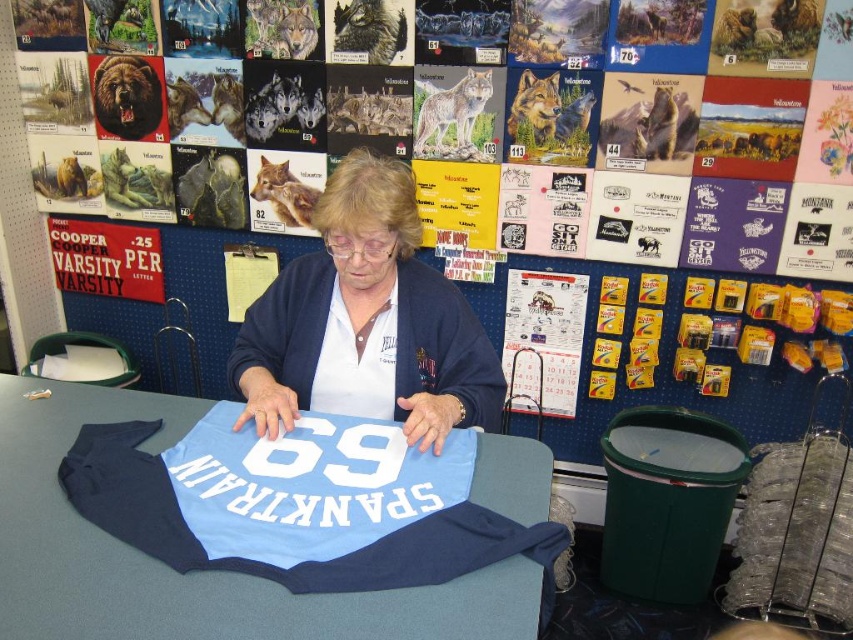
Question: Based on their relative distances, which object is nearer to the light blue fabric shirt at center?

Choices:
 (A) blue fabric shirt at center
 (B) white cotton t-shirt at center

Answer: (A)

Question: Which object is closer to the camera taking this photo?

Choices:
 (A) blue fabric shirt at center
 (B) light blue fabric shirt at center

Answer: (B)

Question: Is light blue fabric shirt at center behind blue fabric shirt at center?

Choices:
 (A) no
 (B) yes

Answer: (A)

Question: Is light blue fabric shirt at center positioned in front of white cotton t-shirt at center?

Choices:
 (A) no
 (B) yes

Answer: (B)

Question: Estimate the real-world distances between objects in this image. Which object is closer to the blue fabric shirt at center?

Choices:
 (A) light blue fabric shirt at center
 (B) white cotton t-shirt at center

Answer: (B)

Question: Is light blue fabric shirt at center closer to camera compared to white cotton t-shirt at center?

Choices:
 (A) yes
 (B) no

Answer: (A)